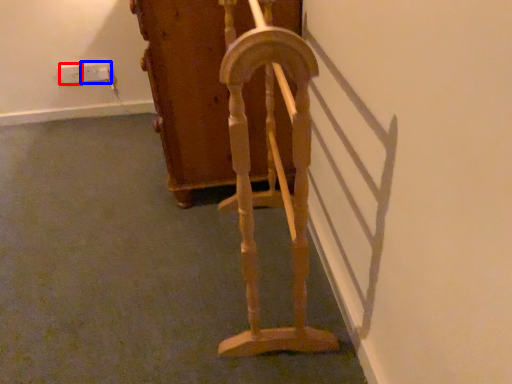
Question: Which of the following is the farthest to the observer, electric outlet (highlighted by a red box) or electric outlet (highlighted by a blue box)?

Choices:
 (A) electric outlet
 (B) electric outlet

Answer: (B)